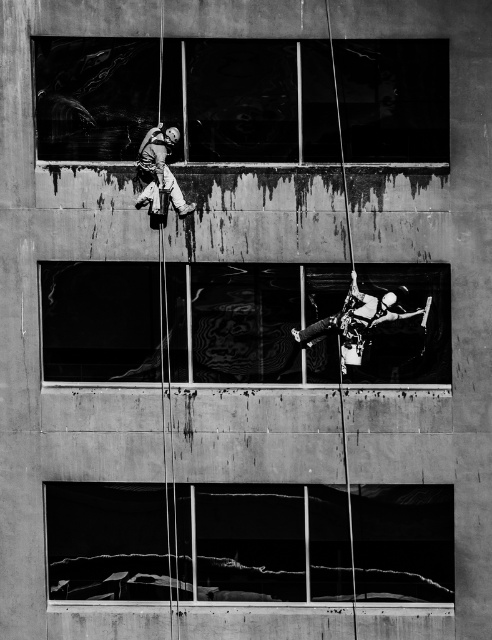
Does point (269, 81) lie in front of point (167, 173)?

No, (269, 81) is behind (167, 173).

Who is positioned more to the right, transparent glass window at upper center or matte gray climbing harness at upper center?

From the viewer's perspective, transparent glass window at upper center appears more on the right side.

Is point (369, 76) farther from viewer compared to point (153, 204)?

Yes.

Locate an element on the screen. Image resolution: width=492 pixels, height=640 pixels. transparent glass window at upper center is located at coordinates (251, 99).

Can you confirm if transparent glass window at lower center is shorter than transparent glass window at center?

No.

Can you confirm if transparent glass window at lower center is smaller than transparent glass window at center?

Yes.

Which is in front, point (181, 524) or point (399, 372)?

Point (399, 372) is in front.

Identify the location of transparent glass window at lower center. (250, 541).

Is transparent glass window at center above metallic climbing harness at center?

Actually, transparent glass window at center is below metallic climbing harness at center.

Does point (372, 284) lie in front of point (357, 285)?

No, (372, 284) is further to viewer.

Locate an element on the screen. This screenshot has height=640, width=492. transparent glass window at center is located at coordinates (315, 323).

This screenshot has height=640, width=492. Find the location of `transparent glass window at center`. transparent glass window at center is located at coordinates (315, 323).